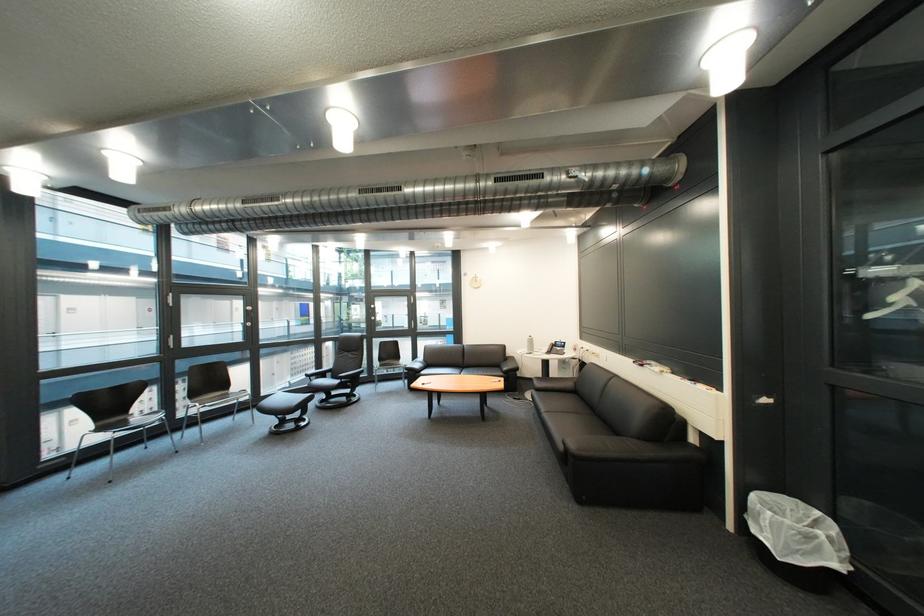
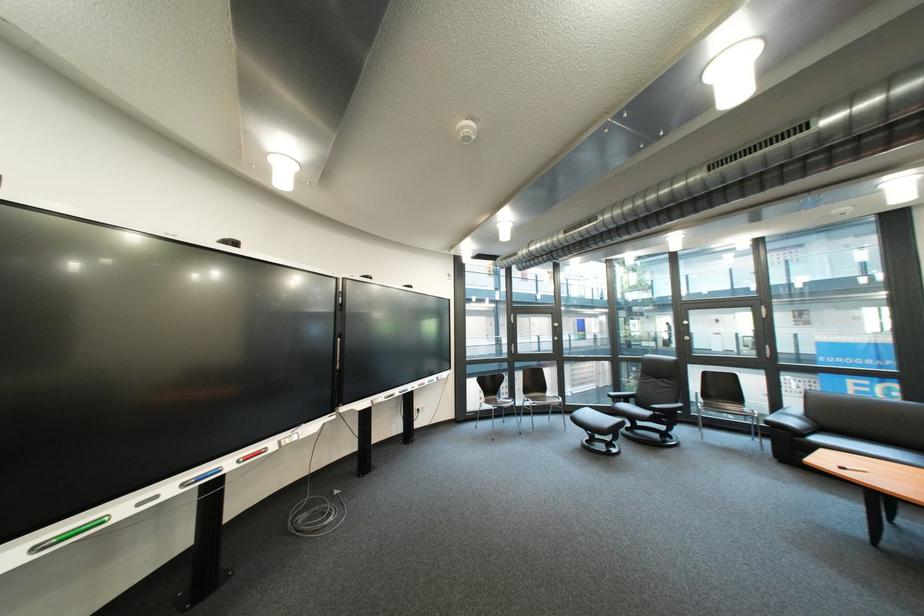
Find the pixel in the second image that matches [357,382] in the first image.

(670, 415)